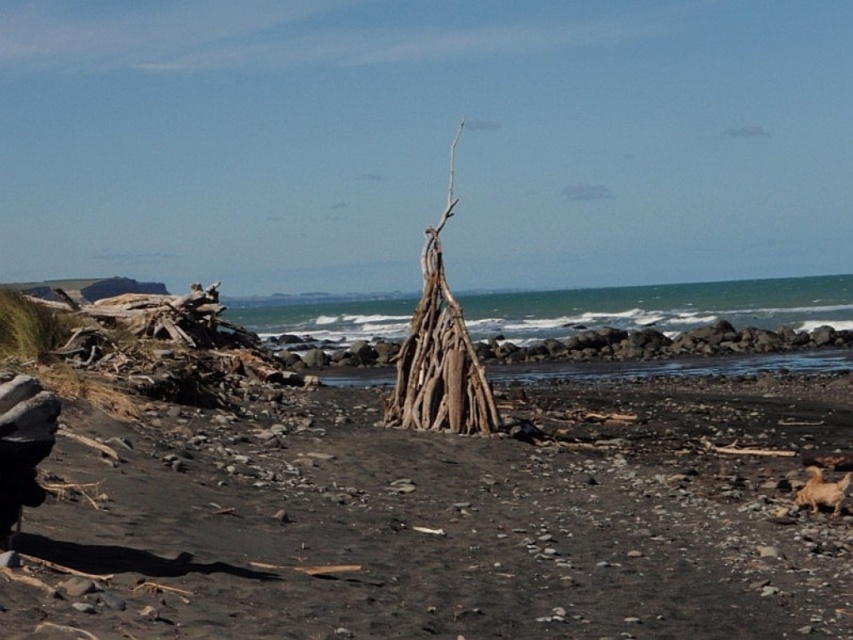
Locate an element on the screen. dark sand at center is located at coordinates (437, 522).

Who is more distant from viewer, (733, 516) or (589, 328)?

The point (589, 328) is more distant.

Find the location of a particular element. dark sand at center is located at coordinates (437, 522).